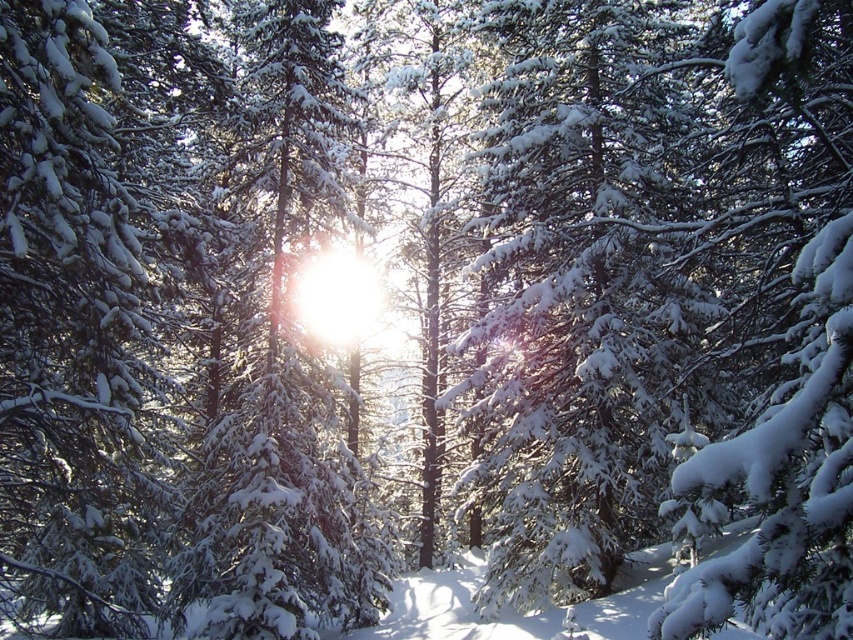
Who is more distant from viewer, (115, 372) or (273, 461)?

The point (273, 461) is behind.

Can you confirm if green matte tree at left is positioned to the left of snow-covered pine tree at center?

Correct, you'll find green matte tree at left to the left of snow-covered pine tree at center.

Who is more distant from viewer, (x=73, y=116) or (x=349, y=595)?

The point (x=349, y=595) is more distant.

The width and height of the screenshot is (853, 640). Identify the location of green matte tree at left. (74, 333).